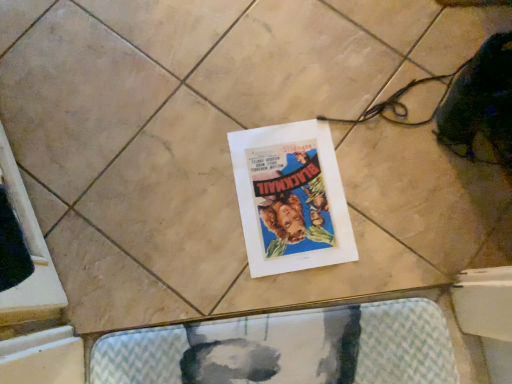
The image size is (512, 384). What are the coordinates of `free space behind matte paper comic book at center` in the screenshot? It's located at (290, 88).